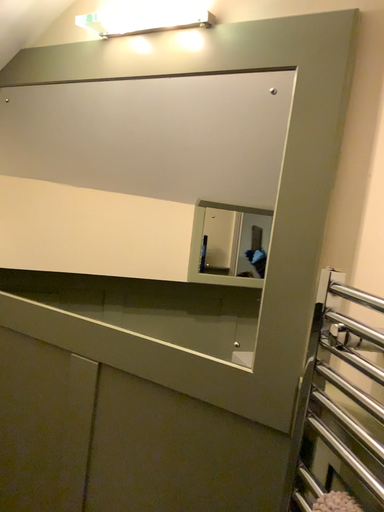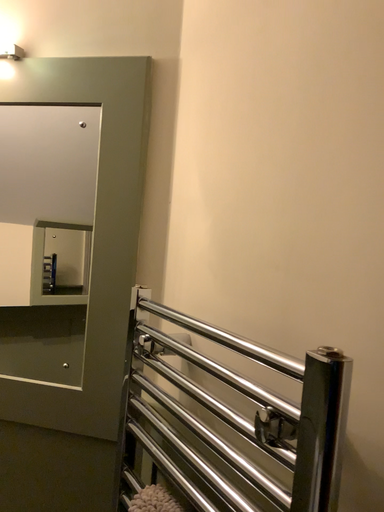
Question: How did the camera likely rotate when shooting the video?

Choices:
 (A) rotated right
 (B) rotated left

Answer: (A)